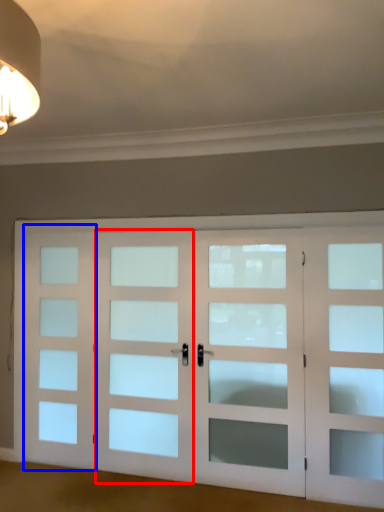
Question: Which of the following is the farthest to the observer, screen door (highlighted by a red box) or screen door (highlighted by a blue box)?

Choices:
 (A) screen door
 (B) screen door

Answer: (B)